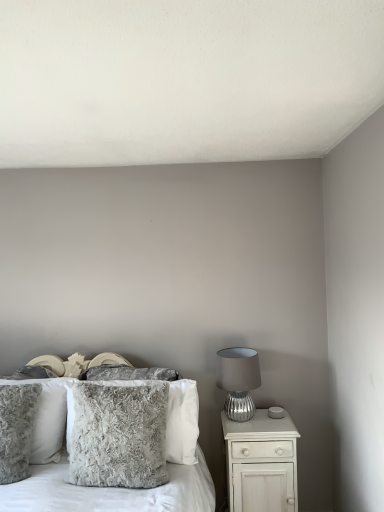
Question: Is fuzzy gray pillow at center, which is the first pillow in front-to-back order, wider or thinner than fluffy gray pillow at left, positioned as the 4th pillow in front-to-back order?

Choices:
 (A) wide
 (B) thin

Answer: (B)

Question: Is fuzzy gray pillow at center, the 4th pillow viewed from the back, to the left or to the right of fluffy gray pillow at left, which ranks as the first pillow in back-to-front order, in the image?

Choices:
 (A) left
 (B) right

Answer: (B)

Question: Based on their relative distances, which object is nearer to the fuzzy gray pillow at center?

Choices:
 (A) white glossy nightstand at right
 (B) fuzzy gray pillow at left, the 3th pillow when ordered from back to front
 (C) fuzzy gray pillow at center, which is the first pillow in front-to-back order
 (D) fluffy gray pillow at left, which ranks as the first pillow in back-to-front order
 (E) fuzzy gray pillow at center, positioned as the second pillow in back-to-front order

Answer: (C)

Question: Estimate the real-world distances between objects in this image. Which object is closer to the fuzzy gray pillow at left, positioned as the 2th pillow in front-to-back order?

Choices:
 (A) fluffy gray pillow at left, which ranks as the first pillow in back-to-front order
 (B) fuzzy gray pillow at center, which is the first pillow in front-to-back order
 (C) silver textured lamp at right
 (D) white glossy nightstand at right
 (E) fuzzy gray pillow at center, which is the 3th pillow in front-to-back order

Answer: (A)